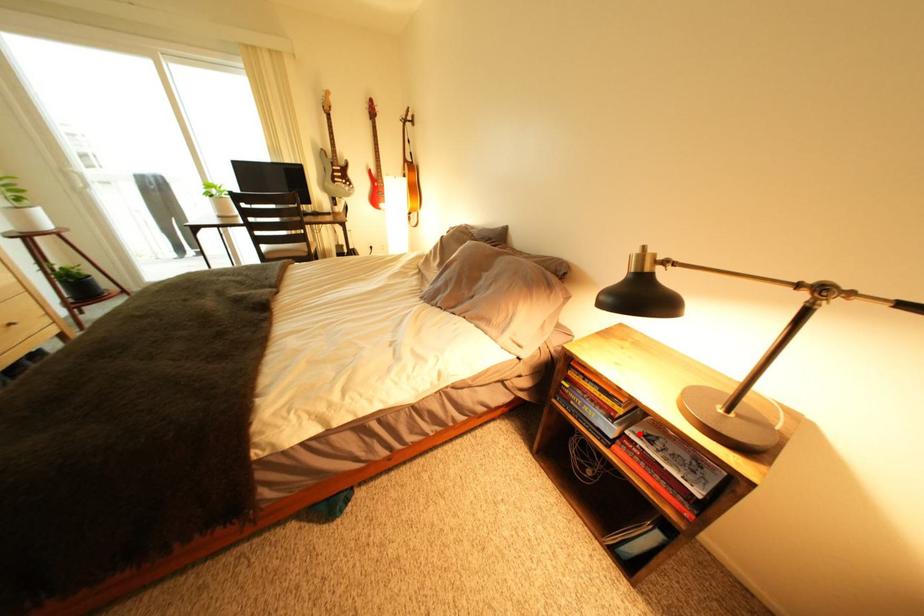
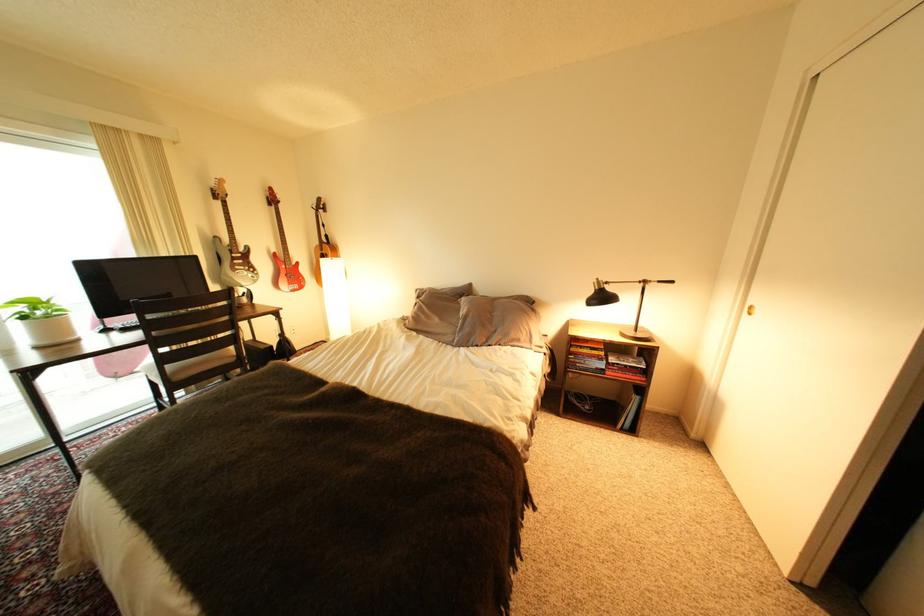
Find the pixel in the second image that matches the highlighted location in the first image.

(623, 363)